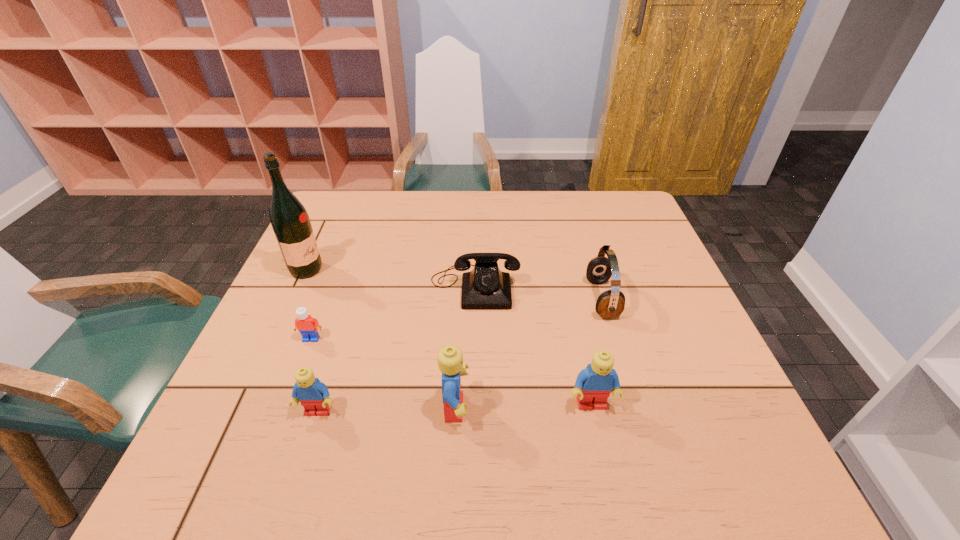
Locate an element on the screen. free space that is in between the headset and the telephone is located at coordinates (539, 292).

The image size is (960, 540). I want to click on free space between the third Lego from left to right and the second shortest Lego, so click(x=387, y=410).

Identify the location of free area in between the headset and the shortest Lego. The image size is (960, 540). (457, 319).

Where is `free spot between the headset and the fourth nearest object`? free spot between the headset and the fourth nearest object is located at coordinates (457, 319).

Choose which object is the third nearest neighbor to the tallest object. Please provide its 2D coordinates. Your answer should be formatted as a tuple, i.e. [(x, y)], where the tuple contains the x and y coordinates of a point satisfying the conditions above.

[(314, 396)]

Find the location of `object that is the third closest one to the sixth object from left to right`. object that is the third closest one to the sixth object from left to right is located at coordinates (486, 287).

Point out which Lego is positioned as the third nearest to the third tallest Lego. Please provide its 2D coordinates. Your answer should be formatted as a tuple, i.e. [(x, y)], where the tuple contains the x and y coordinates of a point satisfying the conditions above.

[(594, 384)]

Point out which Lego is positioned as the third nearest to the third Lego from left to right. Please provide its 2D coordinates. Your answer should be formatted as a tuple, i.e. [(x, y)], where the tuple contains the x and y coordinates of a point satisfying the conditions above.

[(308, 327)]

The image size is (960, 540). Identify the location of free space that satisfies the following two spatial constraints: 1. on the ear cups of the rightmost object; 2. on the face of the second shortest Lego. (636, 411).

Identify the location of vacant area in the image that satisfies the following two spatial constraints: 1. on the ear cups of the headset; 2. on the face of the shortest Lego. (613, 339).